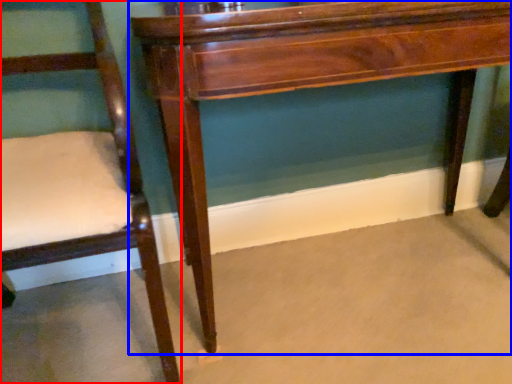
Question: Which of the following is the closest to the observer, chair (highlighted by a red box) or table (highlighted by a blue box)?

Choices:
 (A) chair
 (B) table

Answer: (A)